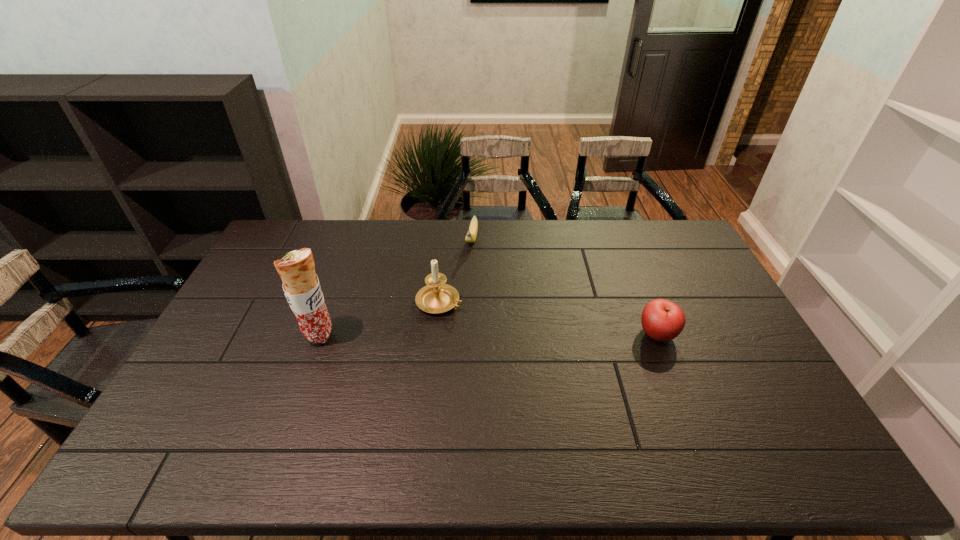
Identify the location of vacant space positioned at the stem of the shortest object. pos(461,298).

This screenshot has width=960, height=540. I want to click on free space located at the stem of the shortest object, so click(466, 276).

The image size is (960, 540). I want to click on free location located 0.160m at the stem of the shortest object, so click(x=465, y=284).

I want to click on vacant region located 0.190m with a handle on the side of the third object from right to left, so click(512, 332).

Locate an element on the screen. vacant space situated 0.070m with a handle on the side of the third object from right to left is located at coordinates (478, 318).

You are a GUI agent. You are given a task and a screenshot of the screen. Output one action in this format:
    pyautogui.click(x=<x>, y=<y>)
    Task: Click on the free space located 0.220m with a handle on the side of the third object from right to left
    The height and width of the screenshot is (540, 960).
    Given the screenshot: What is the action you would take?
    pyautogui.click(x=520, y=336)

The image size is (960, 540). I want to click on object that is at the far edge, so click(x=471, y=235).

At what (x,y) coordinates should I click in order to perform the action: click on free location at the far edge of the desktop. Please return your answer as a coordinate pair (x, y). Looking at the image, I should click on (489, 225).

The height and width of the screenshot is (540, 960). Identify the location of blank space at the near edge of the desktop. (456, 397).

You are a GUI agent. You are given a task and a screenshot of the screen. Output one action in this format:
    pyautogui.click(x=<x>, y=<y>)
    Task: Click on the vacant space at the left edge
    Image resolution: width=960 pixels, height=540 pixels.
    Given the screenshot: What is the action you would take?
    pyautogui.click(x=251, y=350)